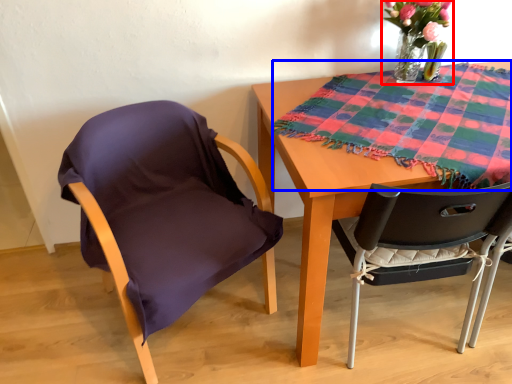
Question: Which of the following is the closest to the observer, floral arrangement (highlighted by a red box) or blanket (highlighted by a blue box)?

Choices:
 (A) floral arrangement
 (B) blanket

Answer: (B)